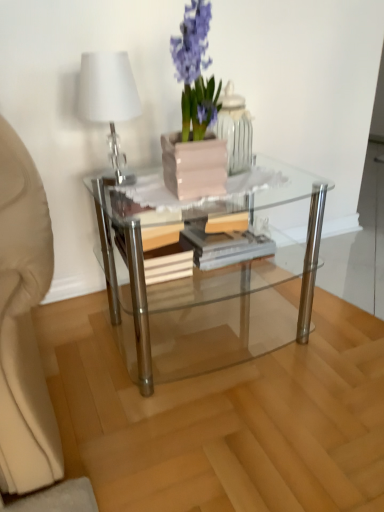
Question: Is wooden at center touching white glossy table lamp at upper left?

Choices:
 (A) no
 (B) yes

Answer: (A)

Question: From a real-world perspective, does wooden at center stand above white glossy table lamp at upper left?

Choices:
 (A) no
 (B) yes

Answer: (A)

Question: Is wooden at center not close to white glossy table lamp at upper left?

Choices:
 (A) no
 (B) yes

Answer: (A)

Question: Considering the relative positions of wooden at center and white glossy table lamp at upper left in the image provided, is wooden at center to the right of white glossy table lamp at upper left from the viewer's perspective?

Choices:
 (A) yes
 (B) no

Answer: (A)

Question: Would you say wooden at center is outside white glossy table lamp at upper left?

Choices:
 (A) no
 (B) yes

Answer: (B)

Question: Does wooden at center have a smaller size compared to white glossy table lamp at upper left?

Choices:
 (A) yes
 (B) no

Answer: (B)

Question: From the image's perspective, is pink glossy vase at upper center located beneath wooden at center?

Choices:
 (A) no
 (B) yes

Answer: (A)

Question: Is wooden at center a part of pink glossy vase at upper center?

Choices:
 (A) no
 (B) yes

Answer: (A)

Question: From a real-world perspective, is pink glossy vase at upper center physically below wooden at center?

Choices:
 (A) no
 (B) yes

Answer: (A)

Question: Is pink glossy vase at upper center facing towards wooden at center?

Choices:
 (A) no
 (B) yes

Answer: (A)

Question: Does pink glossy vase at upper center touch wooden at center?

Choices:
 (A) no
 (B) yes

Answer: (A)

Question: Is pink glossy vase at upper center further to camera compared to wooden at center?

Choices:
 (A) no
 (B) yes

Answer: (A)

Question: Would you say pink glossy vase at upper center is a long distance from white glossy table lamp at upper left?

Choices:
 (A) no
 (B) yes

Answer: (A)